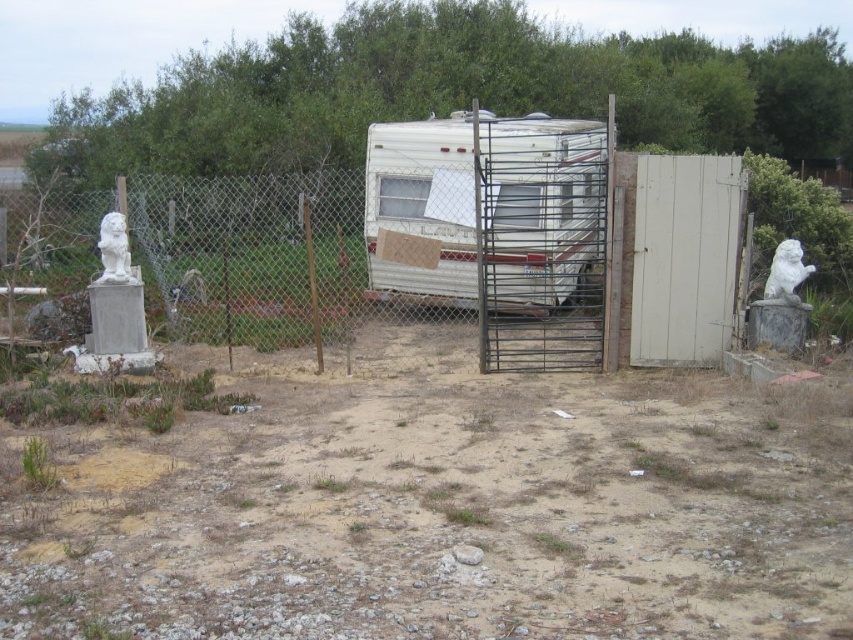
Question: Which of the following is the farthest from the observer?

Choices:
 (A) metallic chain-link fence at left
 (B) metallic gate at center
 (C) dull brown dirt at center

Answer: (A)

Question: Estimate the real-world distances between objects in this image. Which object is farther from the dull brown dirt at center?

Choices:
 (A) white stone lion at right
 (B) metallic chain-link fence at left

Answer: (B)

Question: Does metallic chain-link fence at left have a larger size compared to white plastic trailer at center?

Choices:
 (A) no
 (B) yes

Answer: (A)

Question: Can you confirm if white plastic trailer at center is thinner than white marble lion at left?

Choices:
 (A) no
 (B) yes

Answer: (A)

Question: Can you confirm if metallic chain-link fence at left is positioned above white stone lion at right?

Choices:
 (A) no
 (B) yes

Answer: (A)

Question: Among these objects, which one is nearest to the camera?

Choices:
 (A) white stone lion at right
 (B) white plastic trailer at center
 (C) white marble lion at left

Answer: (A)